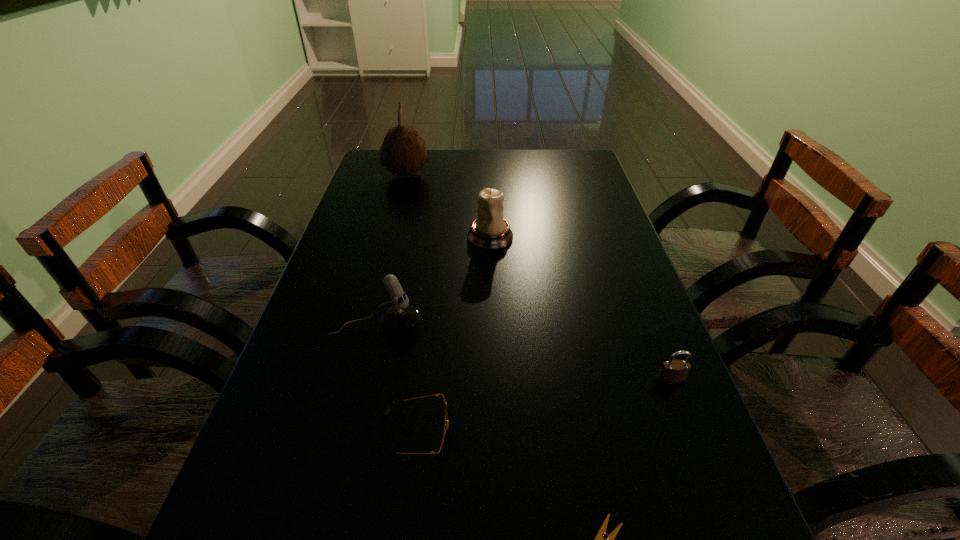
Identify the location of vacant space at the left edge of the desktop. (349, 238).

This screenshot has width=960, height=540. What are the coordinates of `vacant space at the right edge of the desktop` in the screenshot? It's located at (603, 334).

At what (x,y) coordinates should I click in order to perform the action: click on vacant space at the far right corner of the desktop. Please return your answer as a coordinate pair (x, y). Looking at the image, I should click on (577, 150).

Locate an element on the screen. vacant area that lies between the third nearest object and the coconut is located at coordinates (539, 278).

You are a GUI agent. You are given a task and a screenshot of the screen. Output one action in this format:
    pyautogui.click(x=<x>, y=<y>)
    Task: Click on the free space between the third farthest object and the farthest object
    
    Given the screenshot: What is the action you would take?
    pyautogui.click(x=391, y=251)

Find the location of a particular element. The height and width of the screenshot is (540, 960). vacant region between the third farthest object and the rightmost object is located at coordinates (523, 354).

Identify the location of empty location between the tallest object and the fourth nearest object. (391, 251).

Where is `vacant area between the second farthest object and the microphone`? Image resolution: width=960 pixels, height=540 pixels. vacant area between the second farthest object and the microphone is located at coordinates (433, 282).

Locate an element on the screen. Image resolution: width=960 pixels, height=540 pixels. empty space that is in between the rightmost object and the microphone is located at coordinates (523, 354).

This screenshot has height=540, width=960. What are the coordinates of `vacant space that's between the fourth nearest object and the coconut` in the screenshot? It's located at (391, 251).